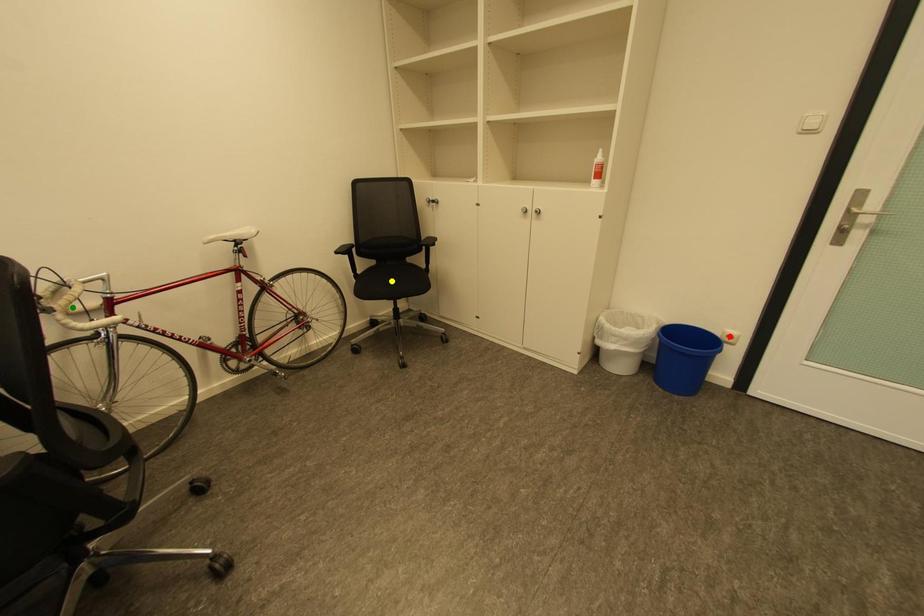
Order these from nearest to farthest:
red point | yellow point | green point

green point, red point, yellow point